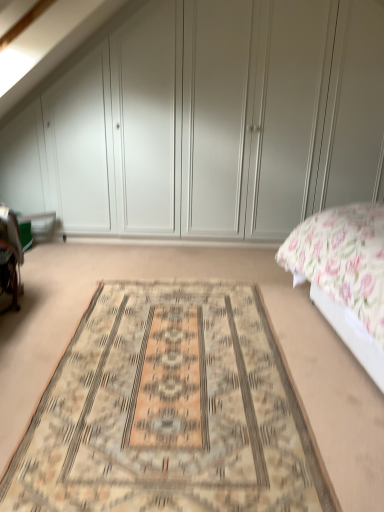
What is the approximate width of floral fabric bed at right?

floral fabric bed at right is 92.55 centimeters in width.

What do you see at coordinates (208, 122) in the screenshot?
I see `white matte wardrobe at upper center` at bounding box center [208, 122].

What do you see at coordinates (170, 411) in the screenshot? This screenshot has height=512, width=384. I see `beige woven rug at center` at bounding box center [170, 411].

Where is `floral fabric bed at right`? floral fabric bed at right is located at coordinates (344, 275).

Does white matte wardrobe at upper center have a larger size compared to floral fabric bed at right?

No, white matte wardrobe at upper center is not bigger than floral fabric bed at right.

Does white matte wardrobe at upper center contain floral fabric bed at right?

No, white matte wardrobe at upper center does not contain floral fabric bed at right.

Does point (348, 106) appear closer or farther from the camera than point (294, 252)?

Point (348, 106) is positioned farther from the camera compared to point (294, 252).

How many degrees apart are the facing directions of white matte wardrobe at upper center and beige woven rug at center?

white matte wardrobe at upper center and beige woven rug at center are facing 3 degrees away from each other.

From a real-world perspective, is white matte wardrobe at upper center on top of beige woven rug at center?

Yes.

Considering the relative positions of white matte wardrobe at upper center and beige woven rug at center in the image provided, is white matte wardrobe at upper center to the right of beige woven rug at center from the viewer's perspective?

Correct, you'll find white matte wardrobe at upper center to the right of beige woven rug at center.

From the picture: Measure the distance between white matte wardrobe at upper center and beige woven rug at center.

The distance of white matte wardrobe at upper center from beige woven rug at center is 2.10 meters.

Considering the positions of objects beige woven rug at center and floral fabric bed at right in the image provided, who is behind, beige woven rug at center or floral fabric bed at right?

beige woven rug at center is behind.

Is beige woven rug at center bigger or smaller than floral fabric bed at right?

In the image, beige woven rug at center appears to be smaller than floral fabric bed at right.

From the image's perspective, is beige woven rug at center above floral fabric bed at right?

No, from the image's perspective, beige woven rug at center is not above floral fabric bed at right.

Is floral fabric bed at right facing towards white matte wardrobe at upper center?

No, floral fabric bed at right is not oriented towards white matte wardrobe at upper center.

Is floral fabric bed at right positioned beyond the bounds of white matte wardrobe at upper center?

floral fabric bed at right lies outside white matte wardrobe at upper center's area.

Consider the image. Which is more to the left, floral fabric bed at right or white matte wardrobe at upper center?

white matte wardrobe at upper center.

Is floral fabric bed at right in contact with white matte wardrobe at upper center?

floral fabric bed at right and white matte wardrobe at upper center are not in contact.

Based on the photo, is beige woven rug at center touching white matte wardrobe at upper center?

No, beige woven rug at center is not touching white matte wardrobe at upper center.

Considering the relative sizes of beige woven rug at center and white matte wardrobe at upper center in the image provided, is beige woven rug at center smaller than white matte wardrobe at upper center?

Yes.

Measure the distance between floral fabric bed at right and beige woven rug at center.

The distance of floral fabric bed at right from beige woven rug at center is 29.00 inches.

Is floral fabric bed at right positioned with its back to beige woven rug at center?

No, floral fabric bed at right's orientation is not away from beige woven rug at center.

From a real-world perspective, is floral fabric bed at right over beige woven rug at center?

Yes, from a real-world perspective, floral fabric bed at right is over beige woven rug at center

Is the surface of floral fabric bed at right in direct contact with beige woven rug at center?

floral fabric bed at right and beige woven rug at center are clearly separated.

The width and height of the screenshot is (384, 512). In order to click on dresser behind the floral fabric bed at right in this screenshot , I will do `click(208, 122)`.

This screenshot has width=384, height=512. In the image, there is a beige woven rug at center. What are the coordinates of `dresser above it (from the image's perspective)` in the screenshot? It's located at (208, 122).

From the image, which object appears to be farther from beige woven rug at center, floral fabric bed at right or white matte wardrobe at upper center?

white matte wardrobe at upper center.

When comparing their distances from beige woven rug at center, does white matte wardrobe at upper center or floral fabric bed at right seem closer?

floral fabric bed at right lies closer to beige woven rug at center than the other object.

When comparing their distances from floral fabric bed at right, does beige woven rug at center or white matte wardrobe at upper center seem closer?

Among the two, beige woven rug at center is located nearer to floral fabric bed at right.

Estimate the real-world distances between objects in this image. Which object is further from floral fabric bed at right, white matte wardrobe at upper center or beige woven rug at center?

white matte wardrobe at upper center lies further to floral fabric bed at right than the other object.

When comparing their distances from white matte wardrobe at upper center, does beige woven rug at center or floral fabric bed at right seem closer?

floral fabric bed at right is closer to white matte wardrobe at upper center.

Looking at the image, which one is located closer to white matte wardrobe at upper center, floral fabric bed at right or beige woven rug at center?

Among the two, floral fabric bed at right is located nearer to white matte wardrobe at upper center.

Identify the location of mat between floral fabric bed at right and white matte wardrobe at upper center in the front-back direction. (170, 411).